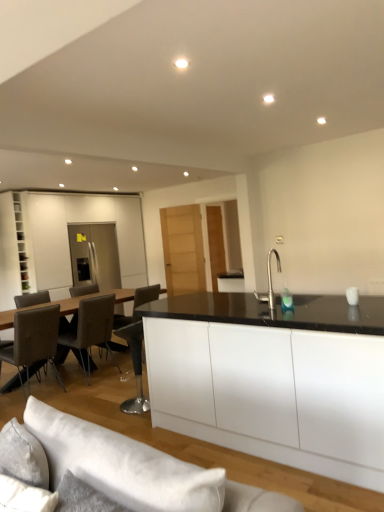
Find the location of a particular element. The width and height of the screenshot is (384, 512). white matte cabinet at left is located at coordinates (14, 251).

Describe the element at coordinates (94, 255) in the screenshot. I see `satin silver refrigerator at left` at that location.

Where is `leather bar stool at center, the 1th chair in the right-to-left sequence`? leather bar stool at center, the 1th chair in the right-to-left sequence is located at coordinates (134, 367).

Which object is positioned more to the right, white fabric couch at lower center or leather at left, acting as the 2th chair starting from the right?

From the viewer's perspective, white fabric couch at lower center appears more on the right side.

Between white fabric couch at lower center and leather at left, acting as the 2th chair starting from the right, which one has more height?

Standing taller between the two is leather at left, acting as the 2th chair starting from the right.

Based on the photo, is white fabric couch at lower center inside the boundaries of leather at left, which is the second chair from left to right, or outside?

white fabric couch at lower center is outside leather at left, which is the second chair from left to right.

Considering their positions, is white fabric couch at lower center located in front of or behind leather at left, which is the second chair from left to right?

Visually, white fabric couch at lower center is located in front of leather at left, which is the second chair from left to right.

How many degrees apart are the facing directions of leather bar stool at center, positioned as the third chair in left-to-right order, and white fabric couch at lower center?

68 degrees.

Which object is further away from the camera, leather bar stool at center, positioned as the third chair in left-to-right order, or white fabric couch at lower center?

leather bar stool at center, positioned as the third chair in left-to-right order.

Is leather bar stool at center, positioned as the third chair in left-to-right order, shorter than white fabric couch at lower center?

No.

At what (x,y) coordinates should I click in order to perform the action: click on studio couch on the right of leather bar stool at center, the 1th chair in the right-to-left sequence. Please return your answer as a coordinate pair (x, y). This screenshot has width=384, height=512. Looking at the image, I should click on [x=137, y=469].

Is leather/chrome chair at left, which is the third chair from right to left, shorter than leather at left, which is the second chair from left to right?

Correct, leather/chrome chair at left, which is the third chair from right to left, is not as tall as leather at left, which is the second chair from left to right.

Between leather/chrome chair at left, which is the third chair from right to left, and leather at left, which is the second chair from left to right, which one appears on the right side from the viewer's perspective?

leather at left, which is the second chair from left to right, is more to the right.

Which object is wider, leather/chrome chair at left, which is the 1th chair in left-to-right order, or leather at left, acting as the 2th chair starting from the right?

Wider between the two is leather at left, acting as the 2th chair starting from the right.

From a real-world perspective, is leather/chrome chair at left, which is the 1th chair in left-to-right order, physically located above or below leather at left, acting as the 2th chair starting from the right?

From a real-world perspective, leather/chrome chair at left, which is the 1th chair in left-to-right order, is physically above leather at left, acting as the 2th chair starting from the right.

Considering the relative sizes of white fabric couch at lower center and leather bar stool at center, the 1th chair in the right-to-left sequence, in the image provided, is white fabric couch at lower center taller than leather bar stool at center, the 1th chair in the right-to-left sequence,?

No, white fabric couch at lower center is not taller than leather bar stool at center, the 1th chair in the right-to-left sequence.

Can we say white fabric couch at lower center lies outside leather bar stool at center, positioned as the third chair in left-to-right order?

Absolutely, white fabric couch at lower center is external to leather bar stool at center, positioned as the third chair in left-to-right order.

From the picture: Can you confirm if white fabric couch at lower center is positioned to the right of leather bar stool at center, positioned as the third chair in left-to-right order?

Indeed, white fabric couch at lower center is positioned on the right side of leather bar stool at center, positioned as the third chair in left-to-right order.

Locate an element on the screen. The width and height of the screenshot is (384, 512). the 1st chair positioned below the satin silver refrigerator at left (from a real-world perspective) is located at coordinates (33, 340).

Which object is positioned more to the right, leather/chrome chair at left, which is the 1th chair in left-to-right order, or satin silver refrigerator at left?

Positioned to the right is leather/chrome chair at left, which is the 1th chair in left-to-right order.

From a real-world perspective, which object rests below the other?

leather/chrome chair at left, which is the third chair from right to left, from a real-world perspective.

Consider the image. Is satin silver refrigerator at left located within leather/chrome chair at left, which is the 1th chair in left-to-right order?

Actually, satin silver refrigerator at left is outside leather/chrome chair at left, which is the 1th chair in left-to-right order.

Would you say leather/chrome chair at left, which is the third chair from right to left, is part of leather at left, which is the second chair from left to right,'s contents?

That's incorrect, leather/chrome chair at left, which is the third chair from right to left, is not inside leather at left, which is the second chair from left to right.

From the image's perspective, does leather at left, which is the second chair from left to right, appear higher than leather/chrome chair at left, which is the third chair from right to left?

Yes, from the image's perspective, leather at left, which is the second chair from left to right, is over leather/chrome chair at left, which is the third chair from right to left.

Choose the correct answer: Is white fabric couch at lower center inside satin silver refrigerator at left or outside it?

white fabric couch at lower center cannot be found inside satin silver refrigerator at left.

Between white fabric couch at lower center and satin silver refrigerator at left, which one has more height?

With more height is satin silver refrigerator at left.

What's the angular difference between white fabric couch at lower center and satin silver refrigerator at left's facing directions?

white fabric couch at lower center and satin silver refrigerator at left are facing 86.1 degrees away from each other.

The image size is (384, 512). I want to click on glass door on the left side of white fabric couch at lower center, so click(94, 255).

Where is `chair above the white fabric couch at lower center (from the image's perspective)`? The height and width of the screenshot is (512, 384). chair above the white fabric couch at lower center (from the image's perspective) is located at coordinates (91, 328).

At what (x,y) coordinates should I click in order to perform the action: click on chair that is the 1st one when counting downward from the white fabric couch at lower center (from the image's perspective). Please return your answer as a coordinate pair (x, y). Looking at the image, I should click on (134, 367).

Considering their positions, is leather bar stool at center, positioned as the third chair in left-to-right order, positioned closer to white matte cabinet at left than white fabric couch at lower center?

leather bar stool at center, positioned as the third chair in left-to-right order, is positioned closer to the anchor white matte cabinet at left.

Considering their positions, is satin silver refrigerator at left positioned closer to leather/chrome chair at left, which is the 1th chair in left-to-right order, than white matte cabinet at left?

Among the two, white matte cabinet at left is located nearer to leather/chrome chair at left, which is the 1th chair in left-to-right order.

Estimate the real-world distances between objects in this image. Which object is further from leather/chrome chair at left, which is the third chair from right to left, leather at left, acting as the 2th chair starting from the right, or white fabric couch at lower center?

Among the two, white fabric couch at lower center is located further to leather/chrome chair at left, which is the third chair from right to left.

From the image, which object appears to be nearer to leather/chrome chair at left, which is the 1th chair in left-to-right order, leather bar stool at center, positioned as the third chair in left-to-right order, or leather at left, which is the second chair from left to right?

The object closer to leather/chrome chair at left, which is the 1th chair in left-to-right order, is leather at left, which is the second chair from left to right.

Based on the photo, from the image, which object appears to be farther from leather at left, acting as the 2th chair starting from the right, white fabric couch at lower center or satin silver refrigerator at left?

white fabric couch at lower center is positioned further to the anchor leather at left, acting as the 2th chair starting from the right.

Considering their positions, is satin silver refrigerator at left positioned further to white fabric couch at lower center than leather bar stool at center, the 1th chair in the right-to-left sequence?

satin silver refrigerator at left is further to white fabric couch at lower center.

Looking at the image, which one is located closer to leather/chrome chair at left, which is the 1th chair in left-to-right order, white fabric couch at lower center or white matte cabinet at left?

white matte cabinet at left is positioned closer to the anchor leather/chrome chair at left, which is the 1th chair in left-to-right order.

Estimate the real-world distances between objects in this image. Which object is further from white fabric couch at lower center, leather/chrome chair at left, which is the third chair from right to left, or white matte cabinet at left?

white matte cabinet at left lies further to white fabric couch at lower center than the other object.

Locate an element on the screen. This screenshot has width=384, height=512. chair located between white fabric couch at lower center and leather/chrome chair at left, which is the 1th chair in left-to-right order, in the depth direction is located at coordinates (134, 367).

I want to click on cabinetry positioned between leather bar stool at center, the 1th chair in the right-to-left sequence, and satin silver refrigerator at left from near to far, so click(14, 251).

Find the location of a particular element. chair located between leather/chrome chair at left, which is the 1th chair in left-to-right order, and satin silver refrigerator at left in the depth direction is located at coordinates (x=91, y=328).

You are a GUI agent. You are given a task and a screenshot of the screen. Output one action in this format:
    pyautogui.click(x=<x>, y=<y>)
    Task: Click on the cabinetry between leather/chrome chair at left, which is the third chair from right to left, and satin silver refrigerator at left in the front-back direction
    
    Given the screenshot: What is the action you would take?
    pyautogui.click(x=14, y=251)